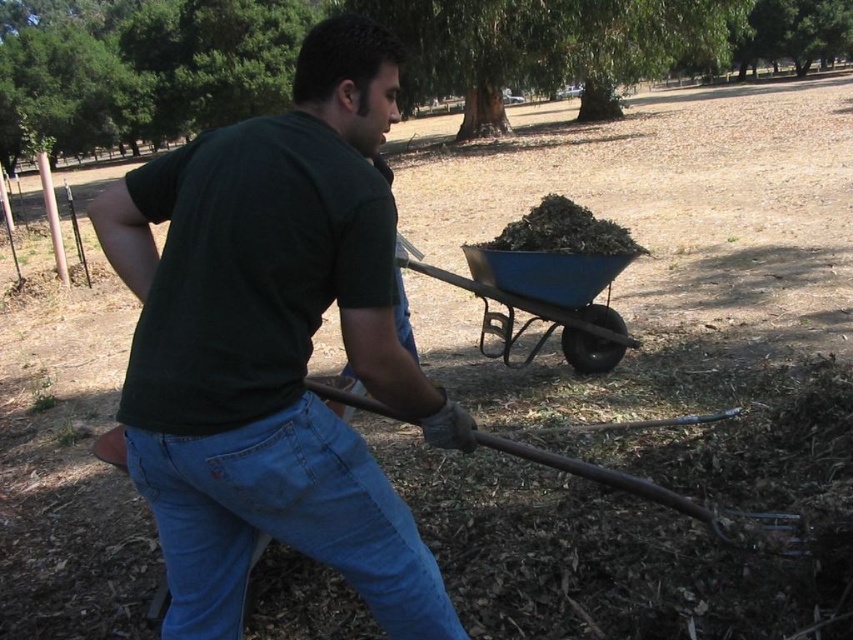
You are standing at the origin point of the coordinate system. The dark green t shirt at center is located at point (274, 346). Can you tell me the coordinates of the dark green t shirt at center?

The dark green t shirt at center is located at point (274, 346).

Based on the photo, you are a gardener who needs to reach the rusty metal shovel at lower center to continue working. However, you are currently standing near the denim at left. Which direction should you move to get to the shovel?

The denim at left is located below the rusty metal shovel at lower center, so you should move upwards from the denim at left to reach the rusty metal shovel at lower center.

You are standing in the park and want to place a small bench between the two points labeled point (360, 572) and point (508, 292). Which point should the bench be closer to if you want it to be near the person pushing the wheelbarrow?

The bench should be closer to point (360, 572) because it is closer to the viewer where the person pushing the wheelbarrow is located.